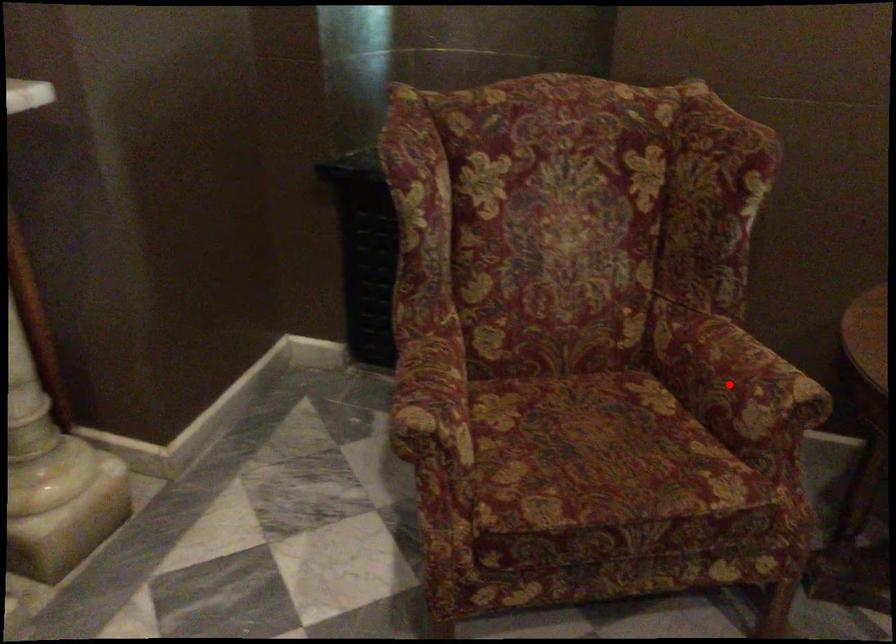
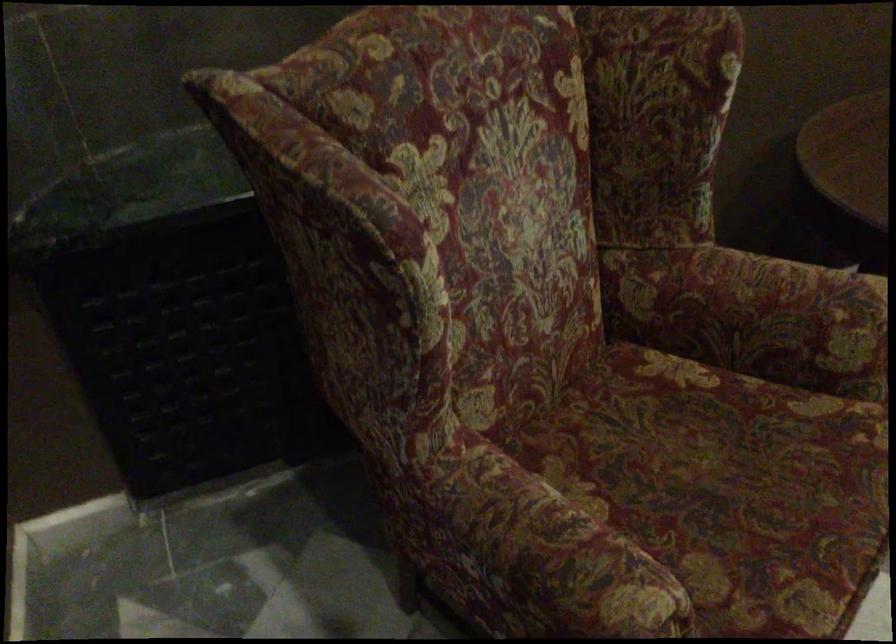
Question: I am providing you with two images of the same scene from different viewpoints. Image1 has a red point marked. In image2, the corresponding 3D location appears at what relative position? Reply with the corresponding letter.

Choices:
 (A) Closer
 (B) Farther

Answer: (A)